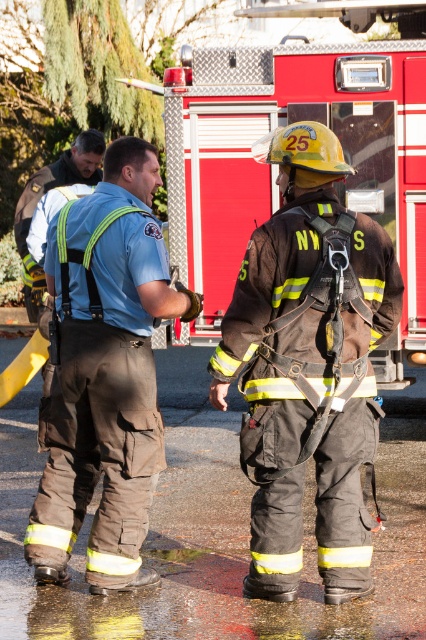
From the picture: Does red metallic fire truck at center have a greater height compared to brown/canvas pants at center?

Yes.

Who is more distant from viewer, (x=386, y=204) or (x=135, y=257)?

The point (x=386, y=204) is more distant.

The width and height of the screenshot is (426, 640). I want to click on red metallic fire truck at center, so click(x=275, y=170).

Between black fireman suit at center and brown/canvas pants at center, which one has more height?

Standing taller between the two is black fireman suit at center.

Is black fireman suit at center wider than brown/canvas pants at center?

Yes.

Describe the element at coordinates (308, 365) in the screenshot. I see `black fireman suit at center` at that location.

What are the coordinates of `black fireman suit at center` in the screenshot? It's located at (308, 365).

Can you confirm if red metallic fire truck at center is wider than brown leather jacket at upper left?

Yes, red metallic fire truck at center is wider than brown leather jacket at upper left.

The height and width of the screenshot is (640, 426). What do you see at coordinates (275, 170) in the screenshot? I see `red metallic fire truck at center` at bounding box center [275, 170].

Between point (411, 321) and point (81, 182), which one is positioned in front?

Positioned in front is point (411, 321).

Identify the location of red metallic fire truck at center. The image size is (426, 640). (275, 170).